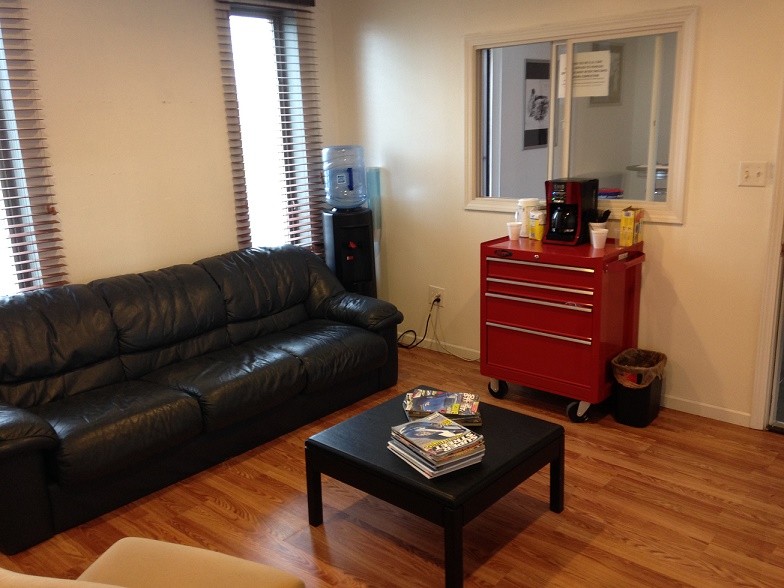
The width and height of the screenshot is (784, 588). I want to click on plug, so click(437, 293).